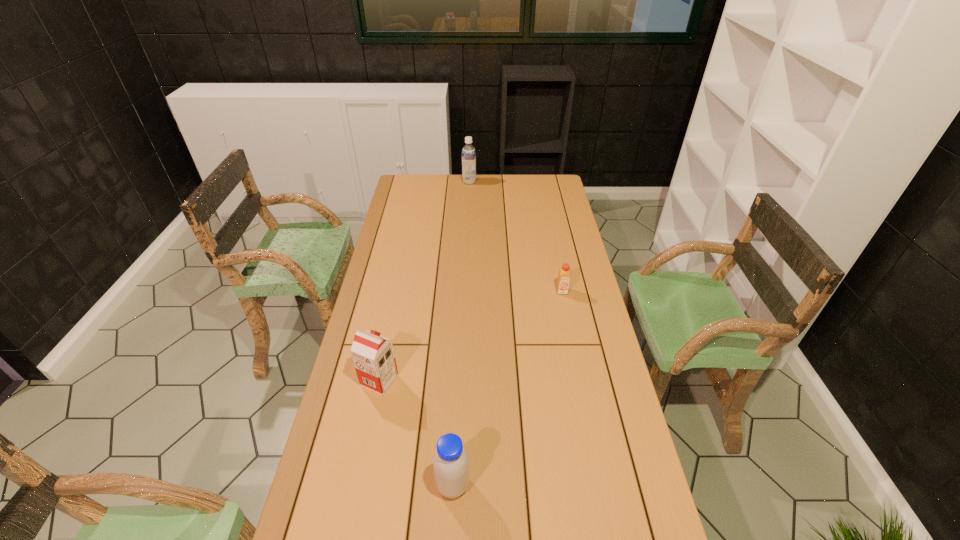
Where is `the farthest soya milk`? The width and height of the screenshot is (960, 540). the farthest soya milk is located at coordinates (468, 152).

Locate an element on the screen. The image size is (960, 540). the leftmost object is located at coordinates coord(373,355).

Locate an element on the screen. The image size is (960, 540). the leftmost soya milk is located at coordinates (373, 355).

At what (x,y) coordinates should I click in order to perform the action: click on the nearest soya milk. Please return your answer as a coordinate pair (x, y). Looking at the image, I should click on (451, 464).

I want to click on the shortest object, so click(564, 273).

You are a GUI agent. You are given a task and a screenshot of the screen. Output one action in this format:
    pyautogui.click(x=<x>, y=<y>)
    Task: Click on the rightmost object
    The image size is (960, 540).
    Given the screenshot: What is the action you would take?
    pyautogui.click(x=564, y=273)

You are a GUI agent. You are given a task and a screenshot of the screen. Output one action in this format:
    pyautogui.click(x=<x>, y=<y>)
    Task: Click on the vacant region located 0.390m on the label of the farthest object
    The height and width of the screenshot is (540, 960).
    Given the screenshot: What is the action you would take?
    pyautogui.click(x=549, y=181)

Where is `vacant space situated on the back of the leftmost object`? This screenshot has height=540, width=960. vacant space situated on the back of the leftmost object is located at coordinates (393, 315).

The width and height of the screenshot is (960, 540). Find the location of `free space located 0.180m on the left of the nearest soya milk`. free space located 0.180m on the left of the nearest soya milk is located at coordinates (368, 485).

Where is `vacant space positioned on the front and back of the shortest object`? This screenshot has height=540, width=960. vacant space positioned on the front and back of the shortest object is located at coordinates (575, 354).